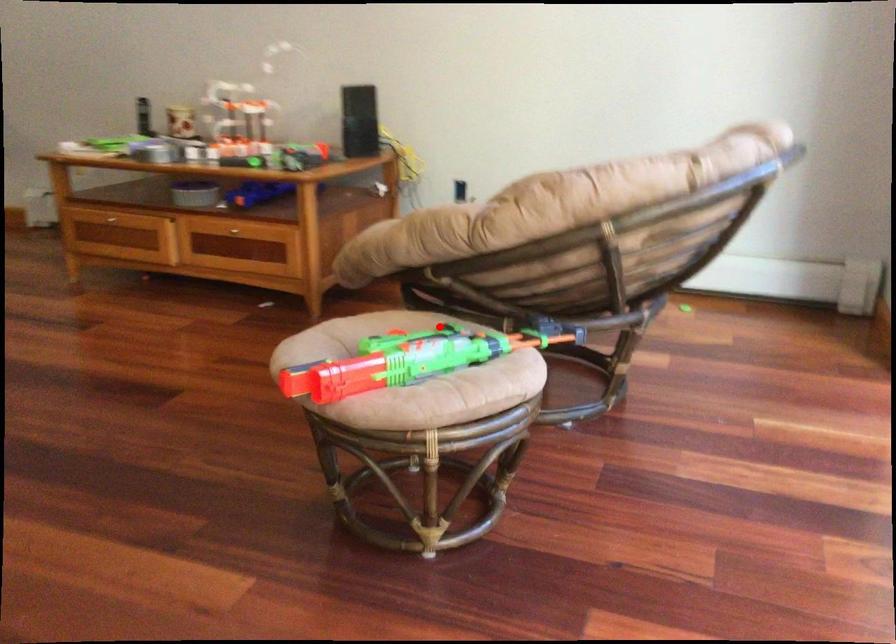
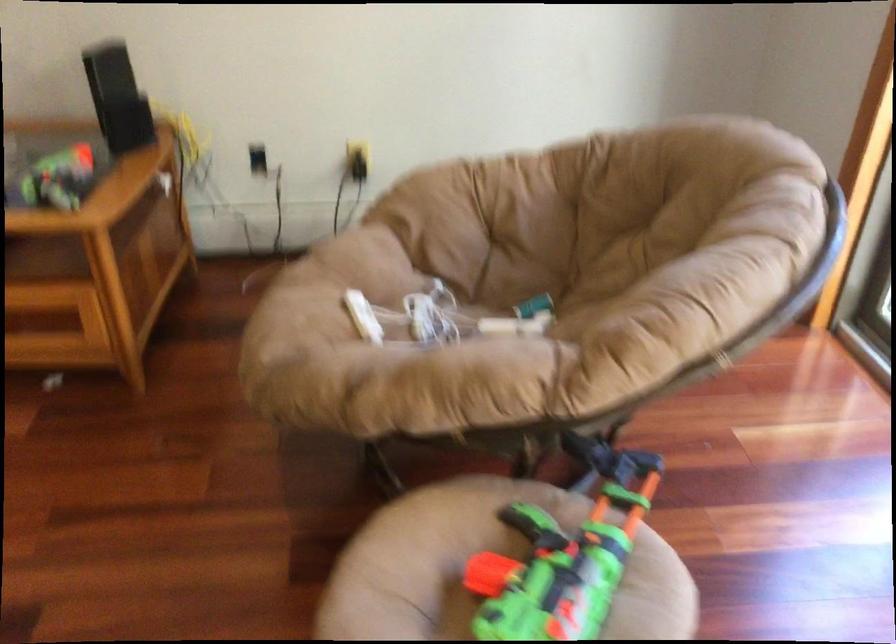
Question: I am providing you with two images of the same scene from different viewpoints. Given a red point in image1, look at the same physical point in image2. Is it:

Choices:
 (A) Closer to the viewpoint
 (B) Farther from the viewpoint

Answer: (A)